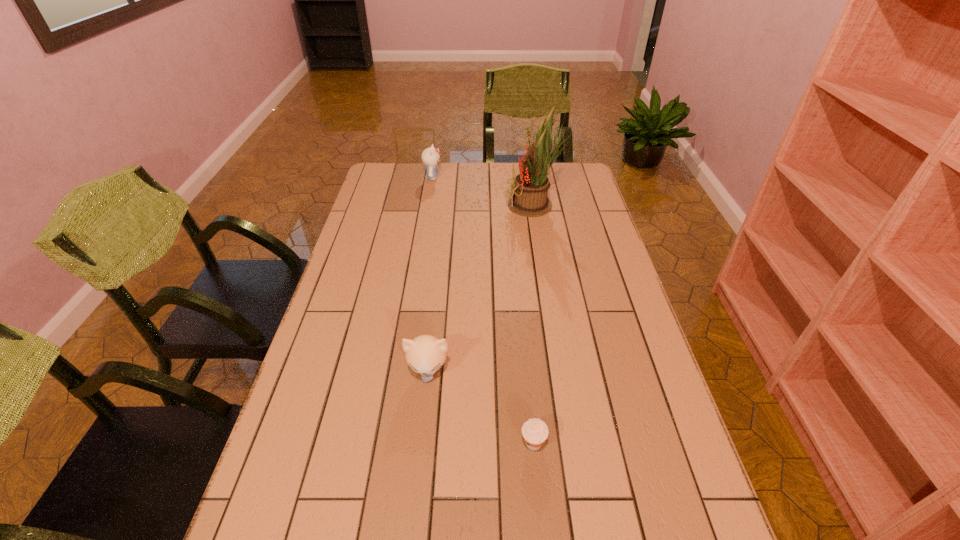
Locate an element on the screen. free space located on the face of the nearer kitten is located at coordinates (410, 538).

Where is `free point located on the back of the nearest object`? free point located on the back of the nearest object is located at coordinates (522, 328).

I want to click on flower arrangement positioned at the far edge, so click(x=530, y=188).

At what (x,y) coordinates should I click in order to perform the action: click on kitten that is positioned at the far edge. Please return your answer as a coordinate pair (x, y). The width and height of the screenshot is (960, 540). Looking at the image, I should click on (430, 156).

This screenshot has width=960, height=540. Find the location of `object situated at the right edge`. object situated at the right edge is located at coordinates (530, 188).

Find the location of a particular element. object positioned at the far right corner is located at coordinates (530, 188).

Where is `vacant point at the far edge`? vacant point at the far edge is located at coordinates (472, 165).

At what (x,y) coordinates should I click in order to perform the action: click on free spot at the left edge of the desktop. Please return your answer as a coordinate pair (x, y). The width and height of the screenshot is (960, 540). Looking at the image, I should click on (355, 251).

In the image, there is a desktop. Find the location of `free space at the right edge`. free space at the right edge is located at coordinates (604, 222).

In the image, there is a desktop. Where is `vacant space at the far left corner`? vacant space at the far left corner is located at coordinates (399, 178).